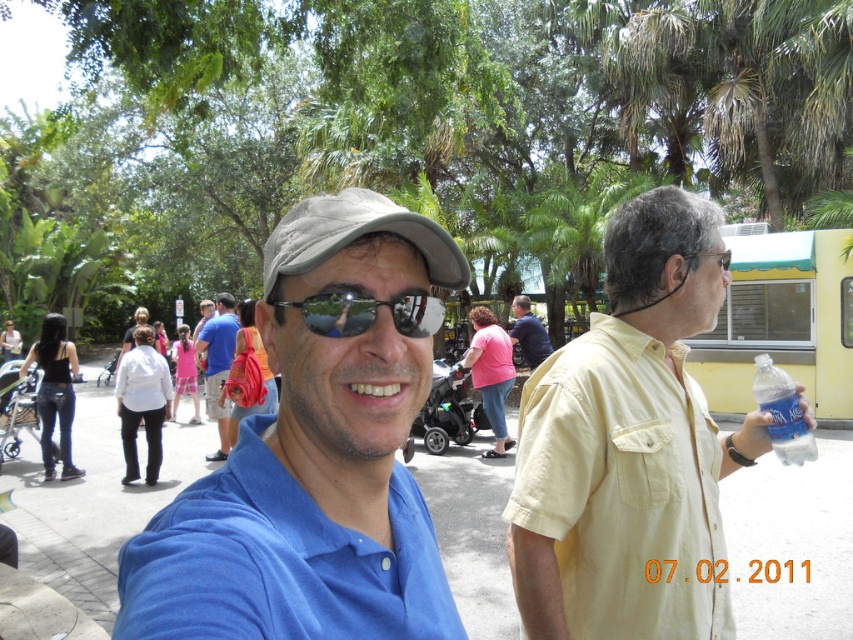
Question: Is yellow cotton shirt at right thinner than sunglasses at center?

Choices:
 (A) no
 (B) yes

Answer: (A)

Question: Is blue matte shirt at center further to the viewer compared to sunglasses at center?

Choices:
 (A) yes
 (B) no

Answer: (B)

Question: Which point is closer to the camera taking this photo?

Choices:
 (A) (770, 419)
 (B) (514, 532)
 (C) (543, 340)
 (D) (376, 310)

Answer: (D)

Question: Which is farther from the yellow cotton shirt at right?

Choices:
 (A) matte blue shirt at center
 (B) blue matte shirt at center
 (C) blue smooth polo shirt at center
 (D) sunglasses at center

Answer: (A)

Question: In this image, where is blue matte shirt at center located relative to sunglasses at center?

Choices:
 (A) above
 (B) below

Answer: (B)

Question: Which point appears closest to the camera in this image?

Choices:
 (A) (523, 321)
 (B) (308, 433)

Answer: (B)